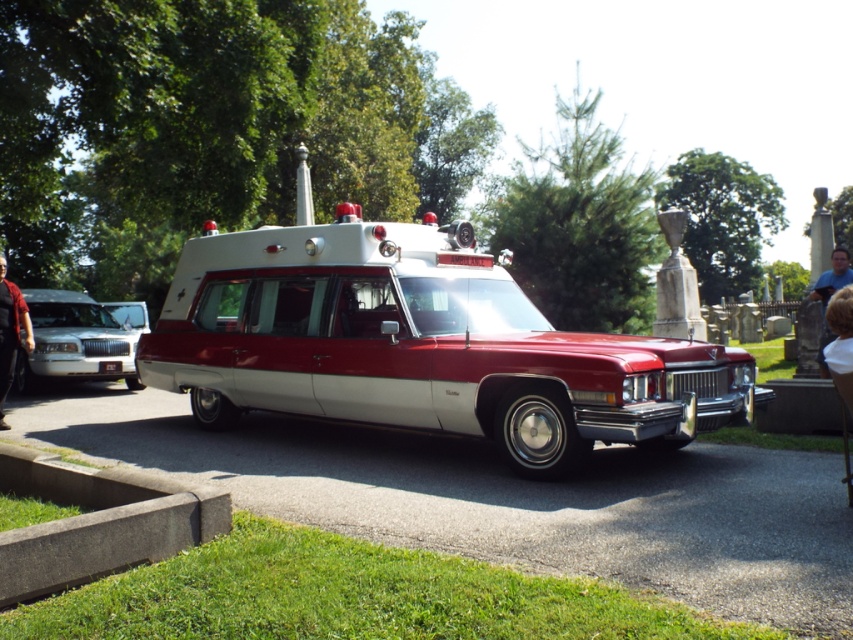
Who is positioned more to the left, white glossy sedan at left or blue denim jeans at lower right?

white glossy sedan at left is more to the left.

Between white glossy sedan at left and blue denim jeans at lower right, which one has less height?

white glossy sedan at left is shorter.

Describe the element at coordinates (74, 340) in the screenshot. I see `white glossy sedan at left` at that location.

Where is `white glossy sedan at left`? The width and height of the screenshot is (853, 640). white glossy sedan at left is located at coordinates (74, 340).

Does point (91, 364) come farther from viewer compared to point (27, 344)?

Yes, it is.

Can you confirm if white glossy sedan at left is thinner than dark red leather jacket at left?

In fact, white glossy sedan at left might be wider than dark red leather jacket at left.

Looking at this image, who is more distant from viewer, [21,291] or [25,307]?

The point [21,291] is behind.

Identify the location of white glossy sedan at left. (74, 340).

I want to click on shiny red hearse at center, so click(421, 344).

Does shiny red hearse at center have a smaller size compared to blue denim jeans at lower right?

Yes, shiny red hearse at center is smaller than blue denim jeans at lower right.

Is point (544, 428) more distant than point (814, 292)?

No, (544, 428) is in front of (814, 292).

In order to click on shiny red hearse at center in this screenshot , I will do `click(421, 344)`.